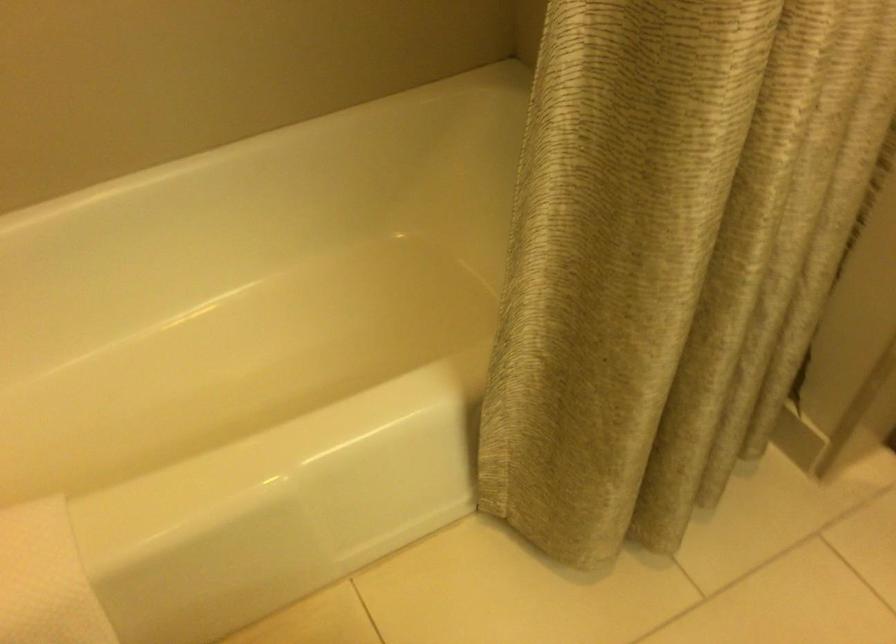
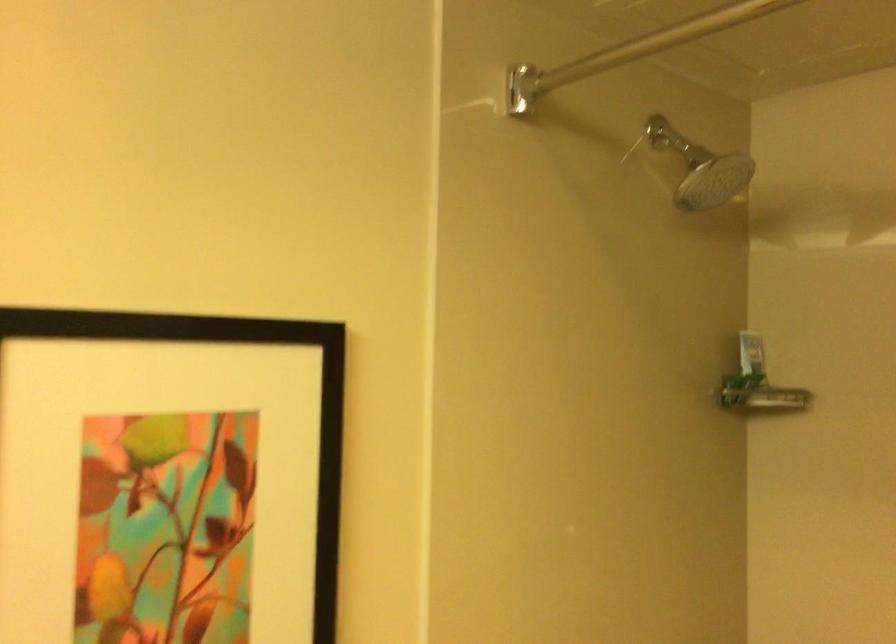
Question: The camera is either moving clockwise (left) or counter-clockwise (right) around the object. The first image is from the beginning of the video and the second image is from the end. Is the camera moving left or right when shooting the video?

Choices:
 (A) Left
 (B) Right

Answer: (B)